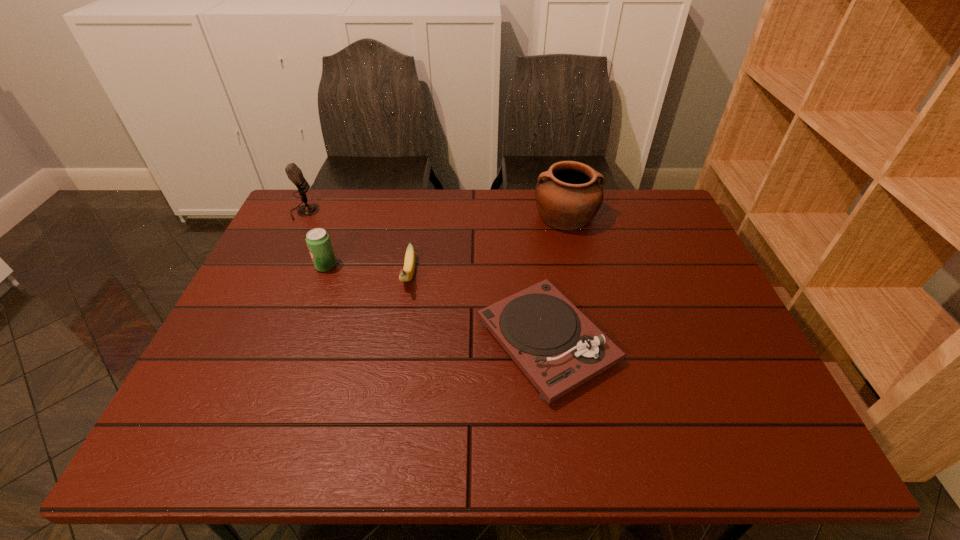
Find the location of a particular element. vacant space situated 0.160m at the stem of the third object from left to right is located at coordinates (396, 347).

In order to click on free location located 0.350m on the back of the shortest object in this screenshot , I will do coord(529,212).

This screenshot has width=960, height=540. I want to click on microphone that is positioned at the far edge, so click(294, 173).

Locate an element on the screen. This screenshot has height=540, width=960. pottery present at the far edge is located at coordinates (568, 196).

Image resolution: width=960 pixels, height=540 pixels. What are the coordinates of `microphone positioned at the left edge` in the screenshot? It's located at tap(294, 173).

At what (x,y) coordinates should I click in order to perform the action: click on soda at the left edge. Please return your answer as a coordinate pair (x, y). Looking at the image, I should click on (318, 241).

Identify the location of object at the far left corner. This screenshot has height=540, width=960. (294, 173).

This screenshot has height=540, width=960. Identify the location of vacant space at the far edge of the desktop. (555, 230).

Image resolution: width=960 pixels, height=540 pixels. In order to click on vacant space at the near edge of the desktop in this screenshot , I will do `click(331, 419)`.

Locate an element on the screen. free space at the left edge of the desktop is located at coordinates (245, 308).